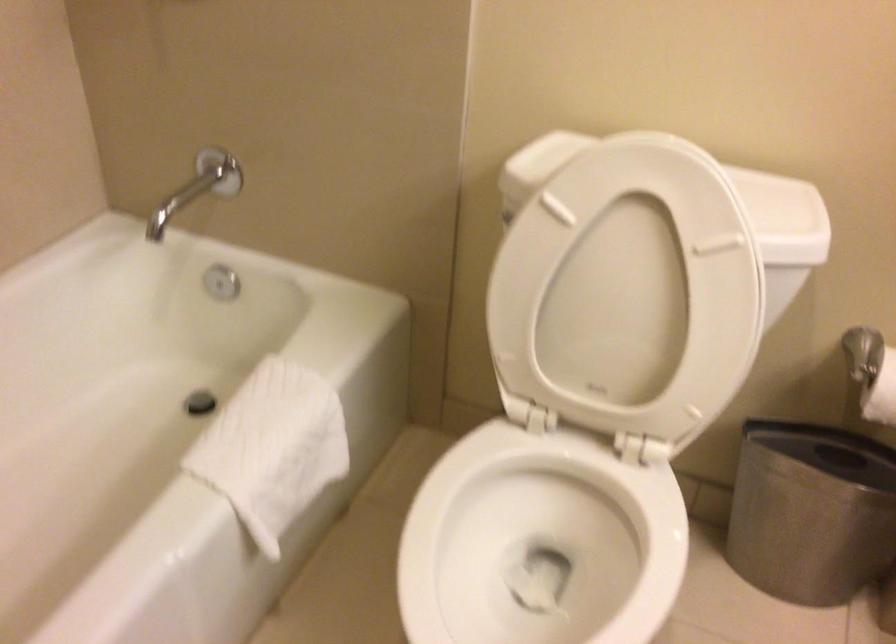
The height and width of the screenshot is (644, 896). I want to click on silver faucet knob, so click(x=220, y=281).